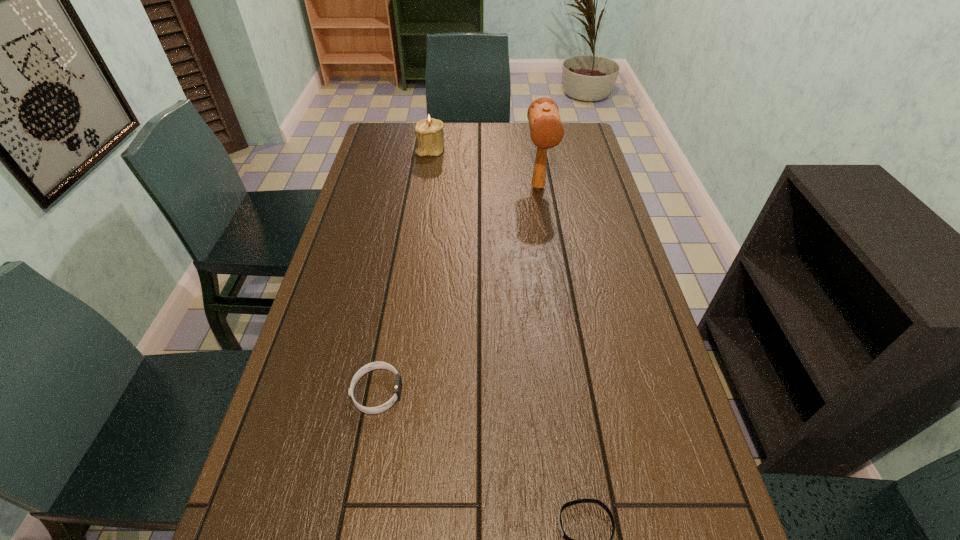
Identify the location of object present at the left edge. The image size is (960, 540). (374, 365).

At what (x,y) coordinates should I click in order to perform the action: click on free point at the far edge. Please return your answer as a coordinate pair (x, y). Looking at the image, I should click on (525, 132).

Where is `free location at the left edge`? This screenshot has height=540, width=960. free location at the left edge is located at coordinates (358, 239).

In order to click on free space at the right edge of the desktop in this screenshot , I will do `click(575, 252)`.

Locate an element on the screen. vacant space at the far left corner of the desktop is located at coordinates (390, 131).

The image size is (960, 540). I want to click on empty space between the farther wristband and the third shortest object, so click(404, 271).

This screenshot has height=540, width=960. What are the coordinates of `vacant space that is in between the second farthest object and the farthest object` in the screenshot? It's located at (484, 168).

I want to click on free point between the farthest object and the third nearest object, so click(484, 168).

What are the coordinates of `vacant space that's between the third shortest object and the third tallest object` in the screenshot? It's located at (404, 271).

At what (x,y) coordinates should I click in order to perform the action: click on empty space between the tallest object and the third tallest object. Please return your answer as a coordinate pair (x, y). Looking at the image, I should click on (458, 289).